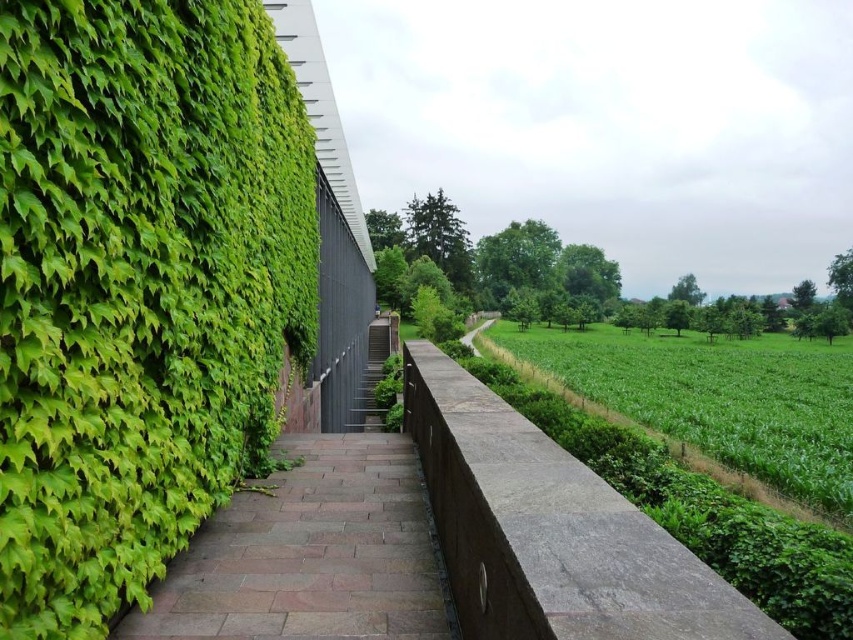
Is green leafy hedge at left smaller than brown stone path at center?

Correct, green leafy hedge at left occupies less space than brown stone path at center.

Which is behind, point (50, 260) or point (282, 616)?

Positioned behind is point (282, 616).

Who is more distant from viewer, (144, 442) or (380, 554)?

The point (380, 554) is behind.

Where is `green leafy hedge at left`? The height and width of the screenshot is (640, 853). green leafy hedge at left is located at coordinates (138, 288).

Based on the photo, can you confirm if brown stone path at center is shorter than metallic gray stairs at center?

Yes, brown stone path at center is shorter than metallic gray stairs at center.

Is brown stone path at center above metallic gray stairs at center?

Correct, brown stone path at center is located above metallic gray stairs at center.

The width and height of the screenshot is (853, 640). Identify the location of brown stone path at center. (x=311, y=554).

Can you confirm if green leafy hedge at left is wider than metallic gray stairs at center?

In fact, green leafy hedge at left might be narrower than metallic gray stairs at center.

Where is `green leafy hedge at left`? This screenshot has width=853, height=640. green leafy hedge at left is located at coordinates (138, 288).

Between point (56, 170) and point (373, 384), which one is positioned in front?

Positioned in front is point (56, 170).

You are a GUI agent. You are given a task and a screenshot of the screen. Output one action in this format:
    pyautogui.click(x=<x>, y=<y>)
    Task: Click on the green leafy hedge at left
    
    Given the screenshot: What is the action you would take?
    pyautogui.click(x=138, y=288)